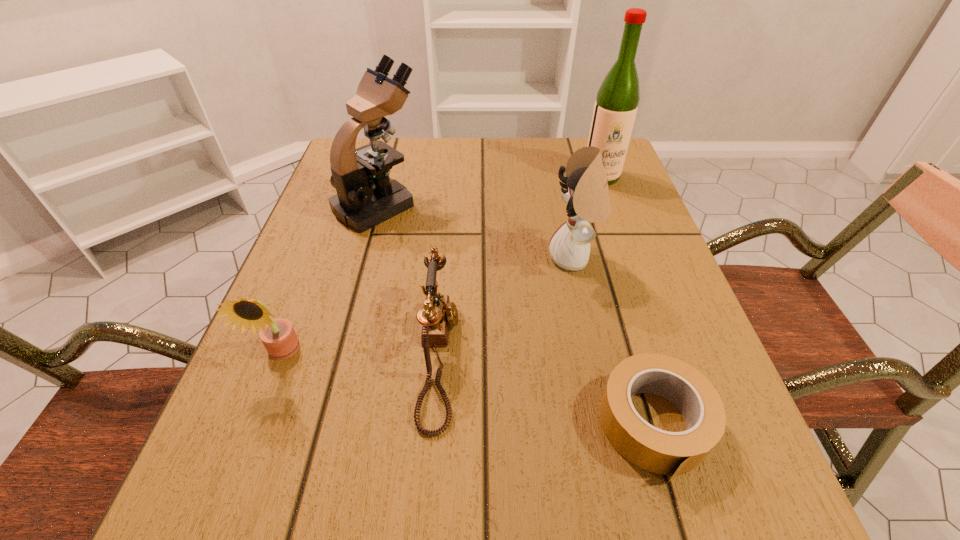
Identify the location of free spot between the duct tape and the second tallest object. This screenshot has width=960, height=540. (516, 315).

At what (x,y) coordinates should I click in order to perform the action: click on free spot between the sunflower and the second shortest object. Please return your answer as a coordinate pair (x, y). This screenshot has height=540, width=960. Looking at the image, I should click on (360, 354).

The height and width of the screenshot is (540, 960). Identify the location of free spot between the doll and the second shortest object. (507, 307).

Find the location of a particular element. The image size is (960, 540). vacant area that lies between the telephone and the tallest object is located at coordinates (519, 266).

Locate an element on the screen. Image resolution: width=960 pixels, height=540 pixels. object that stands as the third closest to the sunflower is located at coordinates (586, 193).

Where is `object that is the nearest to the microscope`? Image resolution: width=960 pixels, height=540 pixels. object that is the nearest to the microscope is located at coordinates (438, 313).

Locate an element on the screen. vacant space that satisfies the following two spatial constraints: 1. on the label of the liquor; 2. at the front face of the fourth shortest object is located at coordinates coord(630,258).